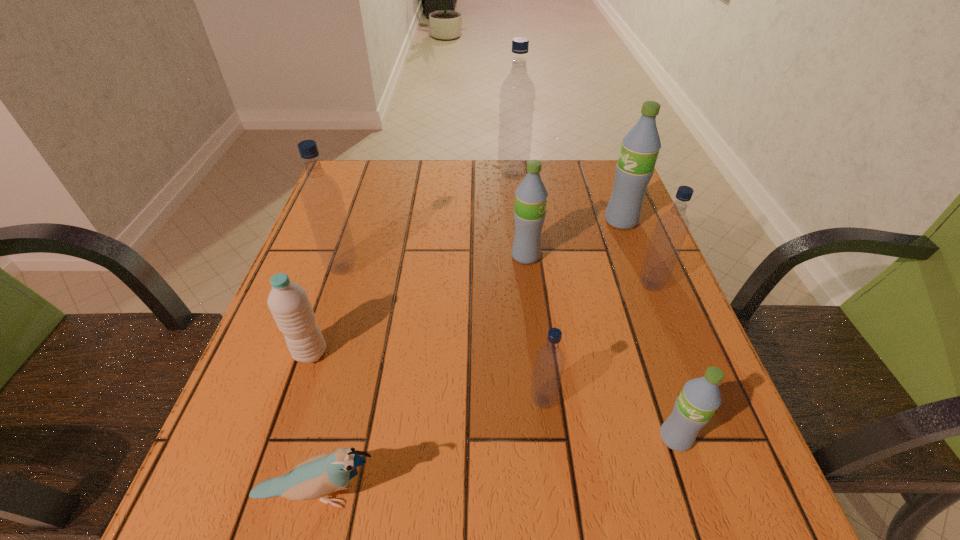
The height and width of the screenshot is (540, 960). Find the location of `vacant space that's between the rightmost blue water bottle and the leftmost blue water bottle`. vacant space that's between the rightmost blue water bottle and the leftmost blue water bottle is located at coordinates (496, 276).

Identify the location of vacant space that's between the leftmost green water bottle and the second biggest blue water bottle. The image size is (960, 540). (434, 262).

The width and height of the screenshot is (960, 540). I want to click on vacant area between the shortest object and the third smallest blue water bottle, so click(x=330, y=382).

Where is `vacant space that's between the white water bottle and the seventh farthest water bottle`? This screenshot has height=540, width=960. vacant space that's between the white water bottle and the seventh farthest water bottle is located at coordinates (426, 376).

Select which object appears as the third closest to the nearest blue water bottle. Please provide its 2D coordinates. Your answer should be formatted as a tuple, i.e. [(x, y)], where the tuple contains the x and y coordinates of a point satisfying the conditions above.

[(671, 229)]

Where is `object that can be found as the fifth closest to the bird`? object that can be found as the fifth closest to the bird is located at coordinates (531, 195).

Where is `water bottle that stands as the fourth closest to the smallest green water bottle`? Image resolution: width=960 pixels, height=540 pixels. water bottle that stands as the fourth closest to the smallest green water bottle is located at coordinates (640, 147).

Select which water bottle is the third closest to the third smallest blue water bottle. Please provide its 2D coordinates. Your answer should be formatted as a tuple, i.e. [(x, y)], where the tuple contains the x and y coordinates of a point satisfying the conditions above.

[(517, 94)]

This screenshot has height=540, width=960. In order to click on the closest blue water bottle to the second biggest green water bottle in this screenshot , I will do `click(671, 229)`.

Identify the location of blue water bottle that stands as the third closest to the blue bird. The width and height of the screenshot is (960, 540). (671, 229).